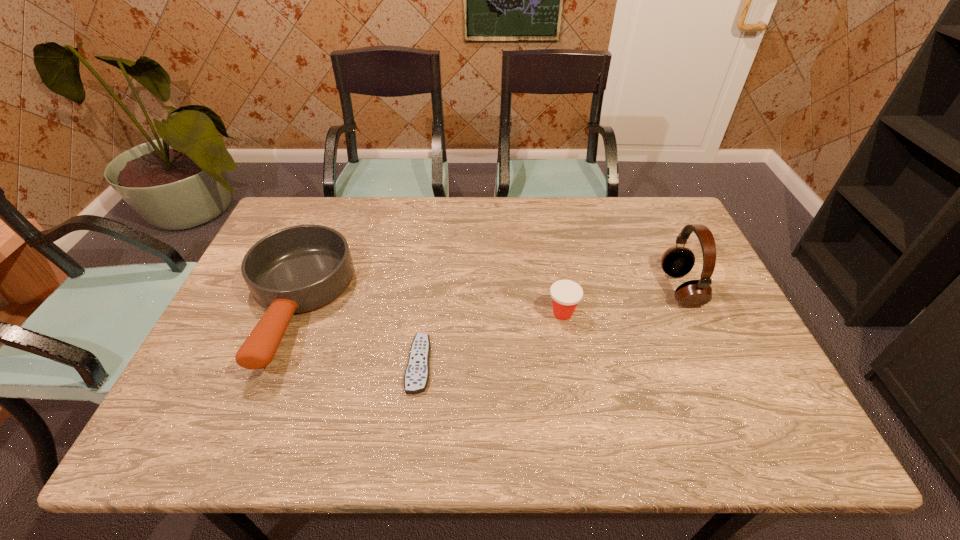
You are a GUI agent. You are given a task and a screenshot of the screen. Output one action in this format:
    pyautogui.click(x=<x>, y=<y>)
    Task: Click on the free space that is in between the headset and the third object from left to right
    The image size is (960, 540).
    Given the screenshot: What is the action you would take?
    pyautogui.click(x=621, y=301)

Locate an element on the screen. The image size is (960, 540). free space between the leftmost object and the shortest object is located at coordinates (356, 335).

Locate an element on the screen. This screenshot has height=540, width=960. vacant space that is in between the rightmost object and the third object from left to right is located at coordinates (621, 301).

I want to click on empty location between the headset and the third object from right to left, so click(549, 327).

Find the location of `free space between the pan and the remote control`. free space between the pan and the remote control is located at coordinates (356, 335).

At what (x,y) coordinates should I click in order to perform the action: click on free space between the Dixie cup and the shortest object. Please return your answer as a coordinate pair (x, y). This screenshot has width=960, height=540. Looking at the image, I should click on (491, 339).

Where is `vacant space in between the second object from left to right and the second object from right to left`? The height and width of the screenshot is (540, 960). vacant space in between the second object from left to right and the second object from right to left is located at coordinates (491, 339).

The image size is (960, 540). Identify the location of free space between the third shortest object and the headset. (487, 298).

Image resolution: width=960 pixels, height=540 pixels. In order to click on vacant region between the third tallest object and the pan in this screenshot , I will do `click(428, 310)`.

The image size is (960, 540). What are the coordinates of `empty location between the tallest object and the second object from right to left` in the screenshot? It's located at (621, 301).